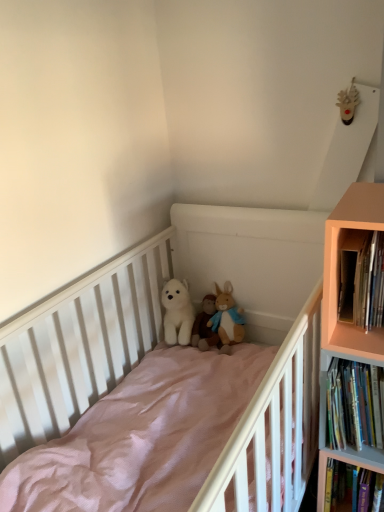
Question: From the image's perspective, is hardcover books at right, the 2th book positioned from the bottom, located beneath white matte crib at center?

Choices:
 (A) yes
 (B) no

Answer: (B)

Question: Does hardcover books at right, the 2th book positioned from the bottom, have a larger size compared to white matte crib at center?

Choices:
 (A) yes
 (B) no

Answer: (B)

Question: Is the position of hardcover books at right, the 2th book positioned from the bottom, more distant than that of white matte crib at center?

Choices:
 (A) no
 (B) yes

Answer: (B)

Question: Is hardcover books at right, the 2th book positioned from the bottom, outside white matte crib at center?

Choices:
 (A) yes
 (B) no

Answer: (A)

Question: Is hardcover books at right, placed as the first book when sorted from top to bottom, oriented away from white matte crib at center?

Choices:
 (A) yes
 (B) no

Answer: (B)

Question: Would you say pale orange wood bookcase at right is inside or outside white matte crib at center?

Choices:
 (A) outside
 (B) inside

Answer: (A)

Question: From the image's perspective, is pale orange wood bookcase at right positioned above or below white matte crib at center?

Choices:
 (A) above
 (B) below

Answer: (A)

Question: From a real-world perspective, is pale orange wood bookcase at right positioned above or below white matte crib at center?

Choices:
 (A) below
 (B) above

Answer: (B)

Question: Considering the positions of point (x=339, y=454) and point (x=33, y=359), is point (x=339, y=454) closer or farther from the camera than point (x=33, y=359)?

Choices:
 (A) farther
 (B) closer

Answer: (B)

Question: From a real-world perspective, relative to hardcover books at right, arranged as the first book when ordered from the bottom, is fluffy white stuffed animal at center, the third toy viewed from the left, vertically above or below?

Choices:
 (A) below
 (B) above

Answer: (A)

Question: Based on their positions, is fluffy white stuffed animal at center, positioned as the first toy in right-to-left order, located to the left or right of hardcover books at right, arranged as the first book when ordered from the bottom?

Choices:
 (A) right
 (B) left

Answer: (B)

Question: From their relative heights in the image, would you say fluffy white stuffed animal at center, the third toy viewed from the left, is taller or shorter than hardcover books at right, the second book when ordered from top to bottom?

Choices:
 (A) short
 (B) tall

Answer: (A)

Question: From the image's perspective, relative to hardcover books at right, arranged as the first book when ordered from the bottom, is fluffy white stuffed animal at center, positioned as the first toy in right-to-left order, above or below?

Choices:
 (A) above
 (B) below

Answer: (A)

Question: From the image's perspective, is white plush bear at center, which is counted as the third toy, starting from the right, above or below white plush bear at center, the 2th toy viewed from the right?

Choices:
 (A) below
 (B) above

Answer: (B)

Question: Would you say white plush bear at center, which is counted as the third toy, starting from the right, is to the left or to the right of white plush bear at center, marked as the second toy in a left-to-right arrangement, in the picture?

Choices:
 (A) right
 (B) left

Answer: (B)